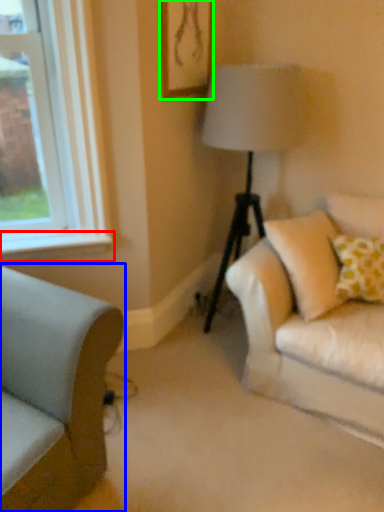
Question: Considering the real-world distances, which object is closest to window sill (highlighted by a red box)? studio couch (highlighted by a blue box) or picture frame (highlighted by a green box).

Choices:
 (A) studio couch
 (B) picture frame

Answer: (A)